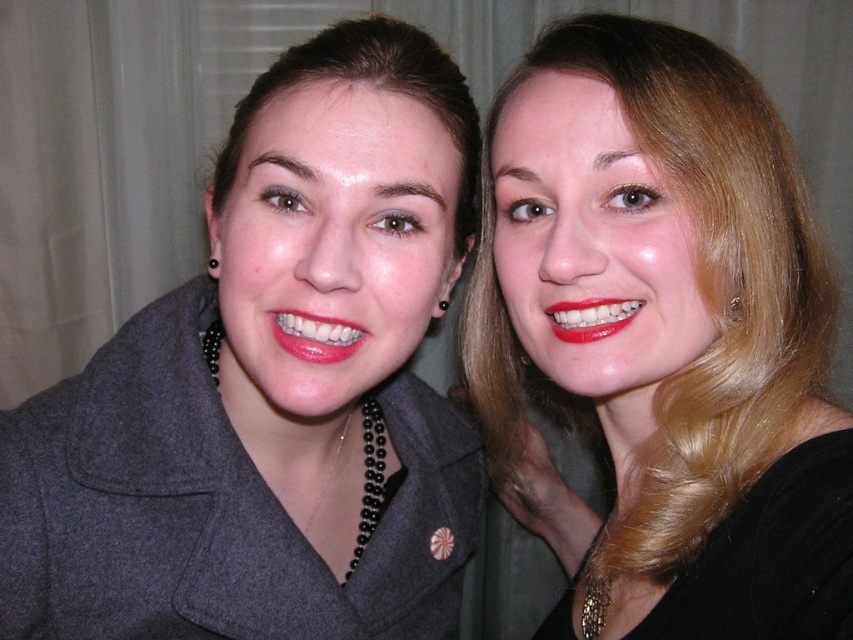
Question: Can you confirm if matte gray coat at left is positioned above glossy matte lipstick at center?

Choices:
 (A) no
 (B) yes

Answer: (A)

Question: Which point is farther to the camera?

Choices:
 (A) (314, 352)
 (B) (611, 440)

Answer: (B)

Question: Is the position of blonde hair at upper right less distant than that of matte red lipstick at right?

Choices:
 (A) no
 (B) yes

Answer: (B)

Question: Which of these objects is positioned closest to the glossy matte lipstick at center?

Choices:
 (A) matte red lipstick at right
 (B) blonde hair at upper right

Answer: (A)

Question: In this image, where is glossy matte lipstick at center located relative to matte red lipstick at right?

Choices:
 (A) left
 (B) right

Answer: (A)

Question: Among these objects, which one is farthest from the camera?

Choices:
 (A) matte red lipstick at right
 (B) matte gray coat at left
 (C) glossy matte lipstick at center
 (D) blonde hair at upper right

Answer: (A)